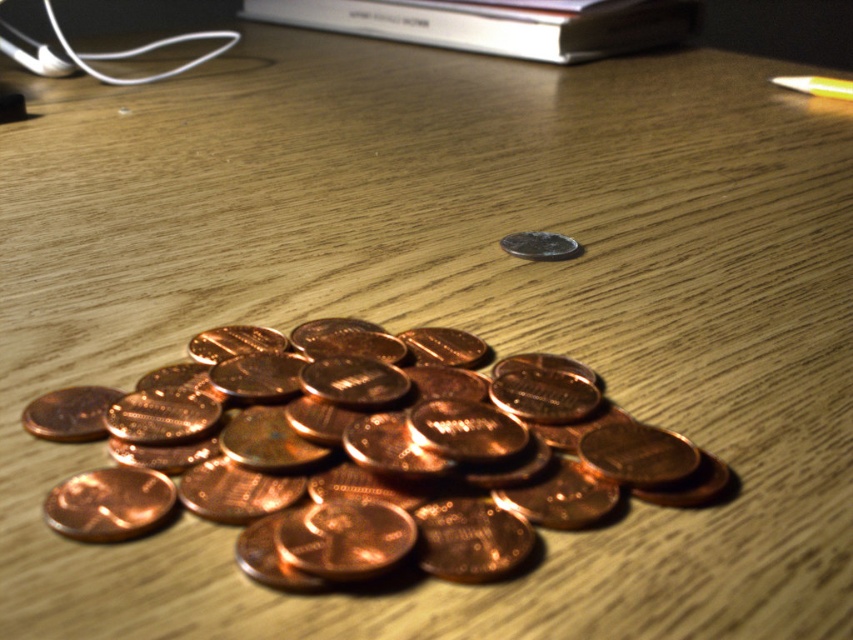
You are standing in front of a wooden table with scattered pennies. You notice two points marked on the table surface at coordinates point (340, 29) and point (814, 77). Which point is closer to you?

Point (340, 29) is closer to you because it is further to the viewer than point (814, 77).

You are organizing items on a wooden table and notice the silver metallic book at upper center and the shiny silver coin at center. Which item is positioned higher up on the table?

The silver metallic book at upper center is located above the shiny silver coin at center, so it is positioned higher up on the table.

You are a person with an arm length of 0.7 meters. You want to pick up the silver metallic book at upper center from where you are standing. Can you reach it without moving your feet?

The silver metallic book at upper center is 1.94 meters away from the viewer. Since your arm length is only 0.7 meters, you cannot reach it without moving your feet.